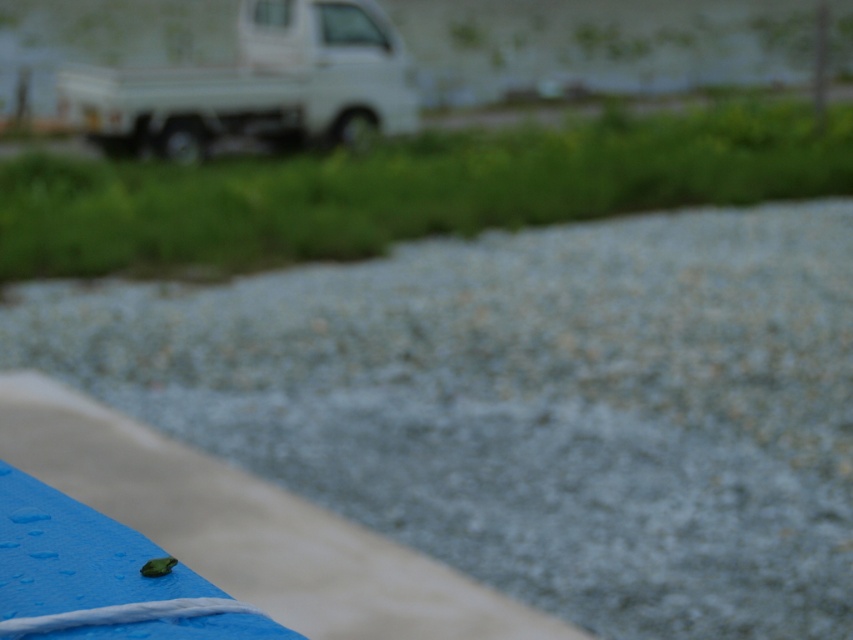
Question: Which object is closer to the camera taking this photo?

Choices:
 (A) gray gravel at center
 (B) white matte truck at upper left

Answer: (A)

Question: Which point appears closest to the camera in this image?

Choices:
 (A) (656, 355)
 (B) (136, 125)

Answer: (A)

Question: Does gray gravel at center come behind white matte truck at upper left?

Choices:
 (A) no
 (B) yes

Answer: (A)

Question: In this image, where is gray gravel at center located relative to white matte truck at upper left?

Choices:
 (A) above
 (B) below

Answer: (B)

Question: Is gray gravel at center thinner than white matte truck at upper left?

Choices:
 (A) no
 (B) yes

Answer: (A)